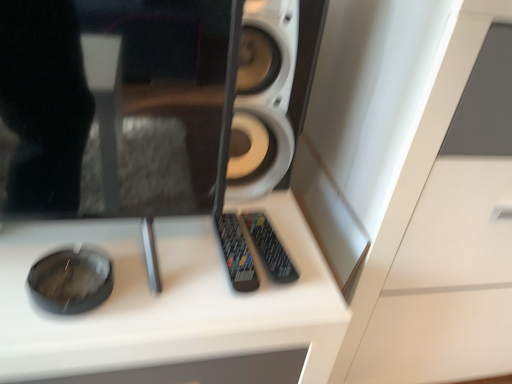
This screenshot has width=512, height=384. In order to click on black plastic remote at center, which is counted as the second control, starting from the left in this screenshot , I will do `click(270, 249)`.

Is the depth of black plastic remote at center, which is the second control from right to left, greater than that of black plastic remote at center, which is counted as the second control, starting from the left?

No, black plastic remote at center, which is the second control from right to left, is closer to the viewer.

I want to click on control that is behind the black plastic remote at center, arranged as the first control when viewed from the left, so click(x=270, y=249).

Is black plastic remote at center, arranged as the first control when viewed from the left, not within black plastic remote at center, arranged as the 1th control when viewed from the right?

black plastic remote at center, arranged as the first control when viewed from the left, lies outside black plastic remote at center, arranged as the 1th control when viewed from the right,'s area.

From the image's perspective, between black plastic remote at center, which is the second control from right to left, and black plastic remote at center, arranged as the 1th control when viewed from the right, who is located below?

black plastic remote at center, which is the second control from right to left.

Who is smaller, white matte speaker at center or black plastic remote at center, arranged as the 1th control when viewed from the right?

Smaller between the two is black plastic remote at center, arranged as the 1th control when viewed from the right.

From the image's perspective, is white matte speaker at center above or below black plastic remote at center, which is counted as the second control, starting from the left?

Based on their image positions, white matte speaker at center is located above black plastic remote at center, which is counted as the second control, starting from the left.

From a real-world perspective, between white matte speaker at center and black plastic remote at center, which is counted as the second control, starting from the left, who is vertically lower?

From a 3D spatial view, black plastic remote at center, which is counted as the second control, starting from the left, is below.

From a real-world perspective, does black plastic remote at center, arranged as the 1th control when viewed from the right, stand above white glossy dresser at center?

Yes, from a real-world perspective, black plastic remote at center, arranged as the 1th control when viewed from the right, is on top of white glossy dresser at center.

Which object is closer to the camera, black plastic remote at center, arranged as the 1th control when viewed from the right, or white glossy dresser at center?

white glossy dresser at center is in front.

Can you tell me how much black plastic remote at center, which is counted as the second control, starting from the left, and white glossy dresser at center differ in facing direction?

The facing directions of black plastic remote at center, which is counted as the second control, starting from the left, and white glossy dresser at center are 4.31 degrees apart.

Considering the sizes of objects black plastic remote at center, arranged as the 1th control when viewed from the right, and white glossy dresser at center in the image provided, who is bigger, black plastic remote at center, arranged as the 1th control when viewed from the right, or white glossy dresser at center?

white glossy dresser at center is bigger.

How different are the orientations of white glossy dresser at center and black plastic remote at center, arranged as the 1th control when viewed from the right, in degrees?

4.31 degrees separate the facing orientations of white glossy dresser at center and black plastic remote at center, arranged as the 1th control when viewed from the right.

Between white glossy dresser at center and black plastic remote at center, arranged as the 1th control when viewed from the right, which one has smaller size?

black plastic remote at center, arranged as the 1th control when viewed from the right, is smaller.

Does white glossy dresser at center have a greater width compared to black plastic remote at center, arranged as the 1th control when viewed from the right?

Yes.

Is white glossy dresser at center not close to black plastic remote at center, arranged as the 1th control when viewed from the right?

No, white glossy dresser at center is in close proximity to black plastic remote at center, arranged as the 1th control when viewed from the right.

Which object is wider, black plastic remote at center, arranged as the first control when viewed from the left, or white glossy dresser at center?

With larger width is white glossy dresser at center.

Is black plastic remote at center, which is the second control from right to left, aimed at white glossy dresser at center?

No, black plastic remote at center, which is the second control from right to left, does not turn towards white glossy dresser at center.

The image size is (512, 384). Identify the location of dresser lying above the black plastic remote at center, arranged as the first control when viewed from the left (from the image's perspective). (446, 227).

How different are the orientations of black plastic remote at center, arranged as the first control when viewed from the left, and white glossy dresser at center in degrees?

The facing directions of black plastic remote at center, arranged as the first control when viewed from the left, and white glossy dresser at center are 0.11 degrees apart.

Are black plastic remote at center, arranged as the 1th control when viewed from the right, and black plastic remote at center, which is the second control from right to left, far apart?

Actually, black plastic remote at center, arranged as the 1th control when viewed from the right, and black plastic remote at center, which is the second control from right to left, are a little close together.

Relative to black plastic remote at center, arranged as the first control when viewed from the left, is black plastic remote at center, which is counted as the second control, starting from the left, in front or behind?

Clearly, black plastic remote at center, which is counted as the second control, starting from the left, is behind black plastic remote at center, arranged as the first control when viewed from the left.

How much distance is there between black plastic remote at center, which is counted as the second control, starting from the left, and black plastic remote at center, arranged as the first control when viewed from the left?

black plastic remote at center, which is counted as the second control, starting from the left, and black plastic remote at center, arranged as the first control when viewed from the left, are 4.31 centimeters apart.

Where is `control above the black plastic remote at center, arranged as the first control when viewed from the left (from the image's perspective)`? The height and width of the screenshot is (384, 512). control above the black plastic remote at center, arranged as the first control when viewed from the left (from the image's perspective) is located at coordinates (270, 249).

From the image's perspective, starting from the white glossy dresser at center, which control is the 2nd one below? Please provide its 2D coordinates.

[(236, 254)]

Is white glossy dresser at center oriented towards black plastic remote at center, arranged as the first control when viewed from the left?

No, white glossy dresser at center is not aimed at black plastic remote at center, arranged as the first control when viewed from the left.

Considering the sizes of white glossy dresser at center and black plastic remote at center, which is the second control from right to left, in the image, is white glossy dresser at center taller or shorter than black plastic remote at center, which is the second control from right to left,?

Clearly, white glossy dresser at center is taller compared to black plastic remote at center, which is the second control from right to left.

Which is more to the right, white glossy dresser at center or black plastic remote at center, arranged as the first control when viewed from the left?

white glossy dresser at center.

Identify the location of control located above the black plastic remote at center, which is the second control from right to left (from the image's perspective). [x=270, y=249].

At what (x,y) coordinates should I click in order to perform the action: click on speaker in front of the black plastic remote at center, which is counted as the second control, starting from the left. Please return your answer as a coordinate pair (x, y). Looking at the image, I should click on pyautogui.click(x=272, y=92).

Looking at the image, which one is located further to black plastic remote at center, arranged as the 1th control when viewed from the right, white glossy dresser at center or white matte speaker at center?

Among the two, white glossy dresser at center is located further to black plastic remote at center, arranged as the 1th control when viewed from the right.

Based on the photo, looking at the image, which one is located further to white glossy dresser at center, black plastic remote at center, which is the second control from right to left, or white matte speaker at center?

black plastic remote at center, which is the second control from right to left, is further to white glossy dresser at center.

Considering their positions, is white glossy dresser at center positioned further to white matte speaker at center than black plastic remote at center, which is the second control from right to left?

The object further to white matte speaker at center is white glossy dresser at center.

Estimate the real-world distances between objects in this image. Which object is closer to white glossy dresser at center, white matte speaker at center or black plastic remote at center, which is the second control from right to left?

white matte speaker at center is closer to white glossy dresser at center.

Looking at the image, which one is located closer to black plastic remote at center, arranged as the 1th control when viewed from the right, black plastic remote at center, arranged as the first control when viewed from the left, or white glossy dresser at center?

black plastic remote at center, arranged as the first control when viewed from the left, is closer to black plastic remote at center, arranged as the 1th control when viewed from the right.

When comparing their distances from black plastic remote at center, arranged as the 1th control when viewed from the right, does white matte speaker at center or black plastic remote at center, which is the second control from right to left, seem further?

The object further to black plastic remote at center, arranged as the 1th control when viewed from the right, is white matte speaker at center.

Considering their positions, is black plastic remote at center, arranged as the 1th control when viewed from the right, positioned closer to black plastic remote at center, arranged as the first control when viewed from the left, than white glossy dresser at center?

Based on the image, black plastic remote at center, arranged as the 1th control when viewed from the right, appears to be nearer to black plastic remote at center, arranged as the first control when viewed from the left.

From the picture: Estimate the real-world distances between objects in this image. Which object is further from black plastic remote at center, arranged as the 1th control when viewed from the right, black plastic remote at center, arranged as the first control when viewed from the left, or white matte speaker at center?

Among the two, white matte speaker at center is located further to black plastic remote at center, arranged as the 1th control when viewed from the right.

I want to click on speaker between black plastic remote at center, arranged as the first control when viewed from the left, and white glossy dresser at center from left to right, so click(272, 92).

I want to click on control between white matte speaker at center and white glossy dresser at center from left to right, so click(270, 249).

Identify the location of control between white matte speaker at center and black plastic remote at center, which is the second control from right to left, in the up-down direction. The height and width of the screenshot is (384, 512). (270, 249).

Image resolution: width=512 pixels, height=384 pixels. I want to click on control between black plastic remote at center, which is the second control from right to left, and white glossy dresser at center, so click(x=270, y=249).